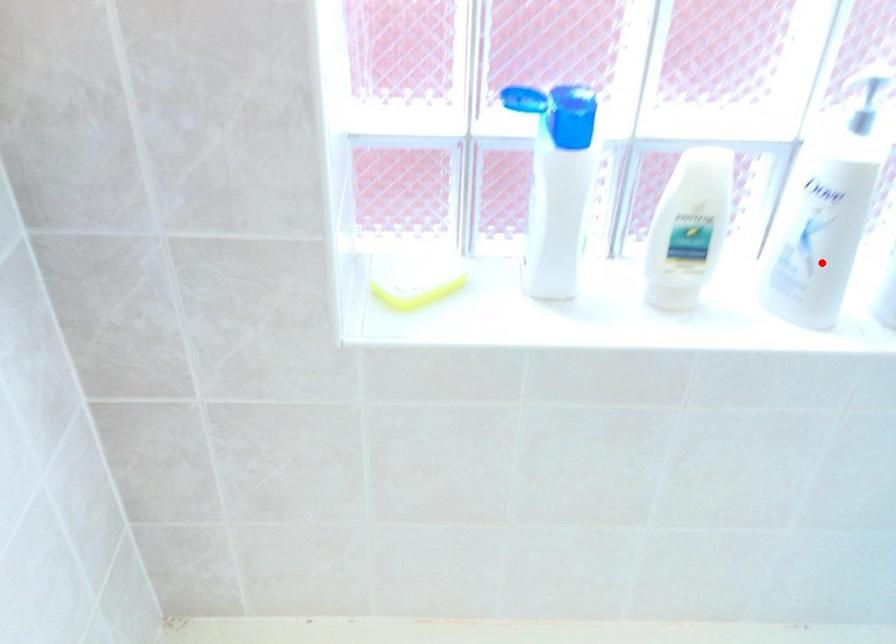
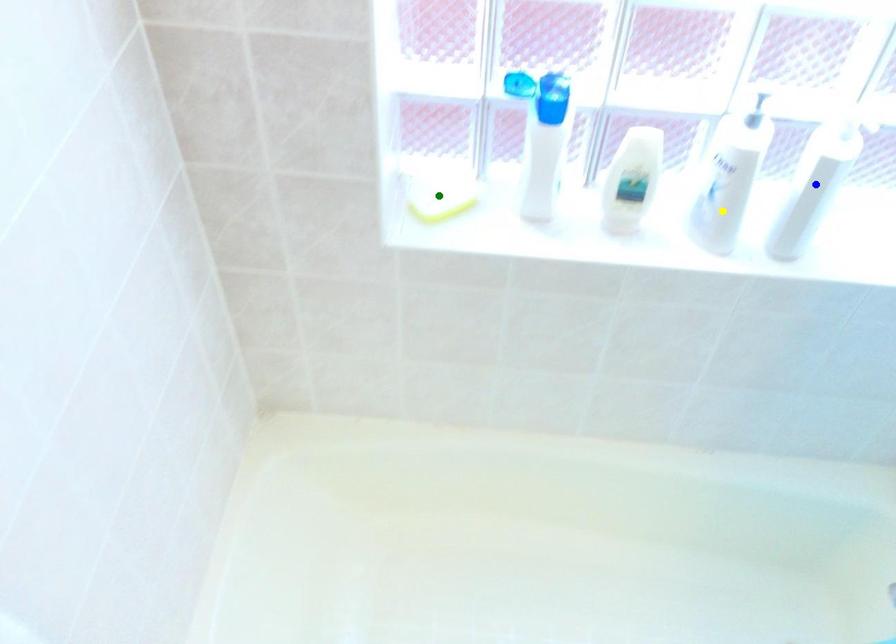
Question: I am providing you with two images of the same scene from different viewpoints. A red point is marked on the first image. You are given multiple points on the second image. Which point in image 2 is actually the same real-world point as the red point in image 1?

Choices:
 (A) yellow point
 (B) blue point
 (C) green point

Answer: (A)